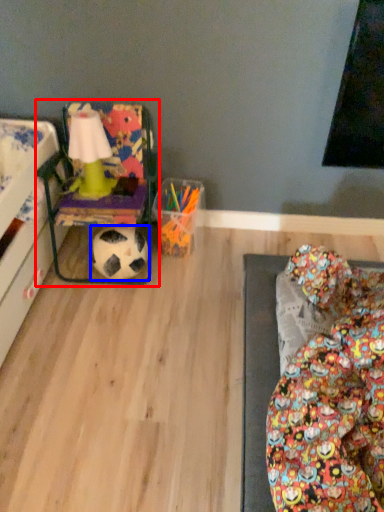
Question: Which object appears closest to the camera in this image, bean bag chair (highlighted by a red box) or football (highlighted by a blue box)?

Choices:
 (A) bean bag chair
 (B) football

Answer: (A)